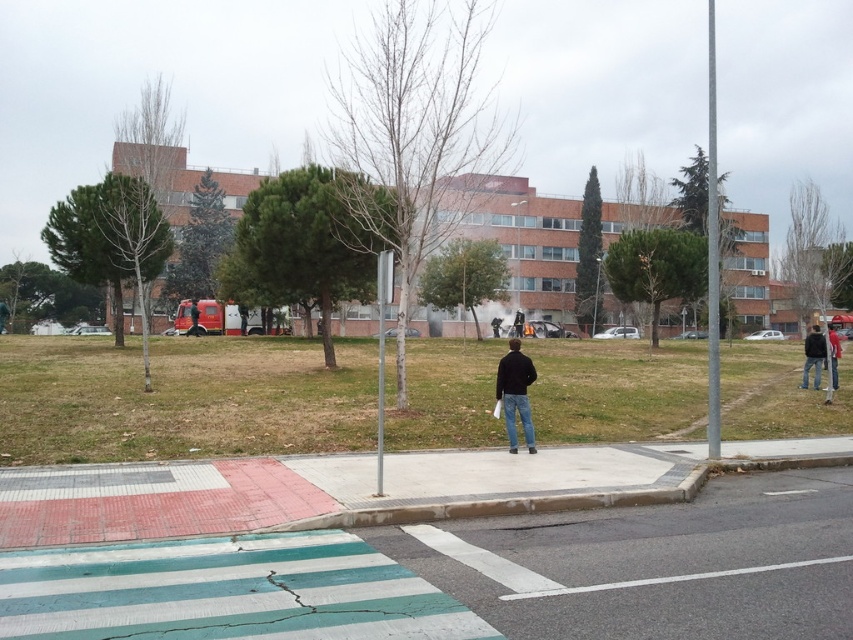
You are standing at the pedestrian crossing in the image and want to find the person wearing dark blue jeans at center. According to the coordinates provided, where should you look relative to the pedestrian crossing?

The dark blue jeans at center is located at coordinates point (515, 394), which places it slightly to the right and above the pedestrian crossing area.

You are a photographer standing at the crosswalk and want to capture both the dark blue jeans at right and the dark blue jeans at lower right in your photo. Which of the two pairs of jeans is positioned lower in the frame?

The dark blue jeans at right is located below dark blue jeans at lower right, so the dark blue jeans at right is positioned lower in the frame.